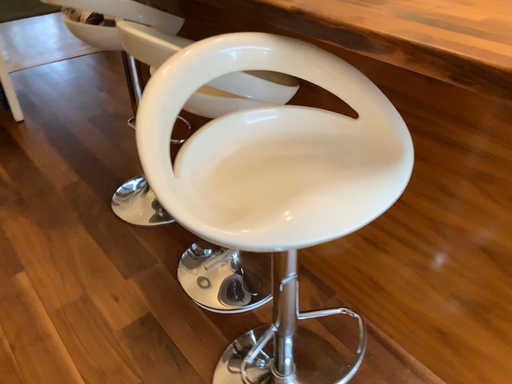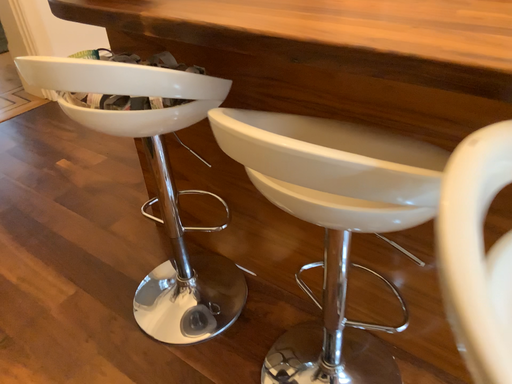
Question: Which way did the camera rotate in the video?

Choices:
 (A) rotated right
 (B) rotated left

Answer: (A)